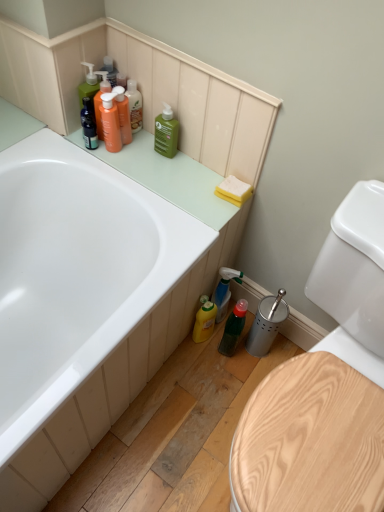
At what (x,y) coordinates should I click in order to perform the action: click on translucent green spray bottle at lower right, positioned as the fourth cleaning product in left-to-right order. Please return your answer as a coordinate pair (x, y). Image resolution: width=384 pixels, height=512 pixels. Looking at the image, I should click on (224, 290).

Describe the element at coordinates (354, 281) in the screenshot. I see `wooden toilet seat at lower right` at that location.

Based on the photo, measure the distance between point (282,436) and camera.

Point (282,436) is 93.60 centimeters away from camera.

The height and width of the screenshot is (512, 384). Identify the location of translucent orange bottles at upper left, arranged as the 1th toiletry when ordered from the bottom. pyautogui.click(x=110, y=122).

Measure the distance between translucent orange bottles at upper left, arranged as the 1th toiletry when ordered from the bottom, and camera.

A distance of 1.23 meters exists between translucent orange bottles at upper left, arranged as the 1th toiletry when ordered from the bottom, and camera.

Locate an element on the screen. yellow matte bottle at lower center, the 1th cleaning product from the bottom is located at coordinates (204, 322).

How far apart are white glossy bathtub at upper left and translucent orange bottle at upper left, the 4th cleaning product viewed from the right?

white glossy bathtub at upper left and translucent orange bottle at upper left, the 4th cleaning product viewed from the right, are 17.61 inches apart from each other.

This screenshot has height=512, width=384. In order to click on bathtub below the translucent orange bottle at upper left, acting as the 4th cleaning product starting from the bottom (from the image's perspective) in this screenshot , I will do `click(75, 272)`.

Based on the photo, is translucent orange bottle at upper left, the 1th cleaning product from the top, located within white glossy bathtub at upper left?

Definitely not — translucent orange bottle at upper left, the 1th cleaning product from the top, is not inside white glossy bathtub at upper left.

Considering the sizes of objects white glossy bathtub at upper left and translucent orange bottle at upper left, acting as the 4th cleaning product starting from the bottom, in the image provided, who is shorter, white glossy bathtub at upper left or translucent orange bottle at upper left, acting as the 4th cleaning product starting from the bottom,?

With less height is translucent orange bottle at upper left, acting as the 4th cleaning product starting from the bottom.

Between white glossy bathtub at upper left and green matte bottle at lower center, which one appears on the right side from the viewer's perspective?

green matte bottle at lower center.

In the scene shown: Considering the sizes of objects white glossy bathtub at upper left and green matte bottle at lower center in the image provided, who is taller, white glossy bathtub at upper left or green matte bottle at lower center?

→ With more height is white glossy bathtub at upper left.

Does white glossy bathtub at upper left turn towards green matte bottle at lower center?

Yes, white glossy bathtub at upper left is aimed at green matte bottle at lower center.

At what (x,y) coordinates should I click in order to perform the action: click on bathtub to the left of green matte bottle at lower center. Please return your answer as a coordinate pair (x, y). The width and height of the screenshot is (384, 512). Looking at the image, I should click on (75, 272).

Is point (102, 114) behind point (135, 94)?

That is False.

How many degrees apart are the facing directions of translucent orange bottles at upper left, arranged as the 1th toiletry when ordered from the bottom, and translucent orange bottle at upper left, the 2th toiletry ordered from the bottom?

The angular difference between translucent orange bottles at upper left, arranged as the 1th toiletry when ordered from the bottom, and translucent orange bottle at upper left, the 2th toiletry ordered from the bottom, is 0.00454 degrees.

Who is bigger, translucent orange bottles at upper left, arranged as the 1th toiletry when ordered from the bottom, or translucent orange bottle at upper left, the 1th toiletry from the top?

With larger size is translucent orange bottles at upper left, arranged as the 1th toiletry when ordered from the bottom.

Is translucent orange bottles at upper left, which ranks as the second toiletry in top-to-bottom order, not near translucent orange bottle at upper left, the 2th toiletry ordered from the bottom?

translucent orange bottles at upper left, which ranks as the second toiletry in top-to-bottom order, is actually quite close to translucent orange bottle at upper left, the 2th toiletry ordered from the bottom.

Is green matte bottle at lower center not near yellow matte bottle at lower center, the second cleaning product positioned from the right?

No, green matte bottle at lower center is not far away from yellow matte bottle at lower center, the second cleaning product positioned from the right.

Is green matte bottle at lower center surrounding yellow matte bottle at lower center, which ranks as the fourth cleaning product in top-to-bottom order?

No, yellow matte bottle at lower center, which ranks as the fourth cleaning product in top-to-bottom order, is not surrounded by green matte bottle at lower center.

Could you tell me if green matte bottle at lower center is facing yellow matte bottle at lower center, the second cleaning product positioned from the right?

No, green matte bottle at lower center is not turned towards yellow matte bottle at lower center, the second cleaning product positioned from the right.

Which of these two, green matte bottle at lower center or yellow matte bottle at lower center, the 3th cleaning product in the left-to-right sequence, is thinner?

yellow matte bottle at lower center, the 3th cleaning product in the left-to-right sequence.

In the scene shown: Is white glossy bathtub at upper left closer to camera compared to yellow matte bottle at lower center, the 1th cleaning product from the bottom?

Yes, it is.

Does white glossy bathtub at upper left have a larger size compared to yellow matte bottle at lower center, the second cleaning product positioned from the right?

Correct, white glossy bathtub at upper left is larger in size than yellow matte bottle at lower center, the second cleaning product positioned from the right.

Does white glossy bathtub at upper left contain yellow matte bottle at lower center, which ranks as the fourth cleaning product in top-to-bottom order?

No, yellow matte bottle at lower center, which ranks as the fourth cleaning product in top-to-bottom order, is not inside white glossy bathtub at upper left.

From the image's perspective, which is below, white glossy bathtub at upper left or yellow matte bottle at lower center, which ranks as the fourth cleaning product in top-to-bottom order?

yellow matte bottle at lower center, which ranks as the fourth cleaning product in top-to-bottom order, from the image's perspective.

Is translucent green spray bottle at lower right, the first cleaning product in the right-to-left sequence, positioned in front of white glossy bathtub at upper left?

No, translucent green spray bottle at lower right, the first cleaning product in the right-to-left sequence, is further to the viewer.

Could you tell me if translucent green spray bottle at lower right, positioned as the fourth cleaning product in left-to-right order, is turned towards white glossy bathtub at upper left?

No.

Is white glossy bathtub at upper left a part of translucent green spray bottle at lower right, the first cleaning product in the right-to-left sequence?

No.

Considering the relative sizes of translucent green spray bottle at lower right, positioned as the fourth cleaning product in left-to-right order, and white glossy bathtub at upper left in the image provided, is translucent green spray bottle at lower right, positioned as the fourth cleaning product in left-to-right order, wider than white glossy bathtub at upper left?

No, translucent green spray bottle at lower right, positioned as the fourth cleaning product in left-to-right order, is not wider than white glossy bathtub at upper left.

Considering the sizes of objects green matte bottle at upper center, the second cleaning product in the left-to-right sequence, and translucent green spray bottle at lower right, positioned as the fourth cleaning product in left-to-right order, in the image provided, who is smaller, green matte bottle at upper center, the second cleaning product in the left-to-right sequence, or translucent green spray bottle at lower right, positioned as the fourth cleaning product in left-to-right order,?

Smaller between the two is green matte bottle at upper center, the second cleaning product in the left-to-right sequence.

Is green matte bottle at upper center, which ranks as the third cleaning product in right-to-left order, spatially inside translucent green spray bottle at lower right, the first cleaning product in the right-to-left sequence, or outside of it?

green matte bottle at upper center, which ranks as the third cleaning product in right-to-left order, exists outside the volume of translucent green spray bottle at lower right, the first cleaning product in the right-to-left sequence.

Considering the points (163, 121) and (226, 310), which point is in front, point (163, 121) or point (226, 310)?

The point (163, 121) is closer.

Between green matte bottle at upper center, the second cleaning product in the left-to-right sequence, and translucent green spray bottle at lower right, which is the second cleaning product from bottom to top, which one has less height?

With less height is green matte bottle at upper center, the second cleaning product in the left-to-right sequence.

At what (x,y) coordinates should I click in order to perform the action: click on cleaning product that is the 2nd object above the white glossy bathtub at upper left (from a real-world perspective). Please return your answer as a coordinate pair (x, y). This screenshot has width=384, height=512. Looking at the image, I should click on (123, 114).

The width and height of the screenshot is (384, 512). In order to click on mouthwash below the white glossy bathtub at upper left (from a real-world perspective) in this screenshot , I will do [x=233, y=328].

Looking at the image, which one is located further to yellow sponge at upper right, translucent orange bottles at upper left, which ranks as the second toiletry in top-to-bottom order, or translucent orange bottle at upper left, the 1th toiletry from the top?

translucent orange bottles at upper left, which ranks as the second toiletry in top-to-bottom order, is positioned further to the anchor yellow sponge at upper right.

Considering their positions, is yellow sponge at upper right positioned closer to green matte bottle at lower center than green matte bottle at upper center, the second cleaning product in the left-to-right sequence?

yellow sponge at upper right is positioned closer to the anchor green matte bottle at lower center.

In the scene shown: Looking at the image, which one is located further to yellow sponge at upper right, wooden toilet seat at lower right or green matte bottle at upper center, the 3th cleaning product positioned from the bottom?

wooden toilet seat at lower right lies further to yellow sponge at upper right than the other object.

When comparing their distances from green matte bottle at upper center, the 3th cleaning product positioned from the bottom, does wooden toilet seat at lower right or yellow matte bottle at lower center, the second cleaning product positioned from the right, seem further?

The object further to green matte bottle at upper center, the 3th cleaning product positioned from the bottom, is wooden toilet seat at lower right.

From the image, which object appears to be farther from yellow sponge at upper right, translucent orange bottles at upper left, arranged as the 1th toiletry when ordered from the bottom, or green matte bottle at upper center, the 3th cleaning product positioned from the bottom?

Among the two, translucent orange bottles at upper left, arranged as the 1th toiletry when ordered from the bottom, is located further to yellow sponge at upper right.

From the image, which object appears to be nearer to translucent green spray bottle at lower right, arranged as the third cleaning product when viewed from the top, translucent orange bottles at upper left, which ranks as the second toiletry in top-to-bottom order, or translucent orange bottle at upper left, the 1th toiletry from the top?

The object closer to translucent green spray bottle at lower right, arranged as the third cleaning product when viewed from the top, is translucent orange bottles at upper left, which ranks as the second toiletry in top-to-bottom order.

In the scene shown: When comparing their distances from translucent orange bottles at upper left, which ranks as the second toiletry in top-to-bottom order, does green matte bottle at lower center or green matte bottle at upper center, the 3th cleaning product positioned from the bottom, seem closer?

green matte bottle at upper center, the 3th cleaning product positioned from the bottom.

From the image, which object appears to be farther from translucent orange bottle at upper left, the 1th toiletry from the top, white glossy bathtub at upper left or yellow matte bottle at lower center, the 3th cleaning product in the left-to-right sequence?

Based on the image, yellow matte bottle at lower center, the 3th cleaning product in the left-to-right sequence, appears to be further to translucent orange bottle at upper left, the 1th toiletry from the top.

The height and width of the screenshot is (512, 384). What are the coordinates of `toiletry between translucent orange bottle at upper left, which ranks as the first cleaning product in left-to-right order, and wooden toilet seat at lower right from top to bottom` in the screenshot? It's located at (110, 122).

Find the location of `mouthwash between white glossy bathtub at upper left and translucent green spray bottle at lower right, positioned as the fourth cleaning product in left-to-right order, in the front-back direction`. mouthwash between white glossy bathtub at upper left and translucent green spray bottle at lower right, positioned as the fourth cleaning product in left-to-right order, in the front-back direction is located at coordinates (233, 328).

Where is `toiletry located between white glossy bathtub at upper left and yellow sponge at upper right in the depth direction`? Image resolution: width=384 pixels, height=512 pixels. toiletry located between white glossy bathtub at upper left and yellow sponge at upper right in the depth direction is located at coordinates (110, 122).

Where is `toiletry that lies between translucent orange bottle at upper left, the 2th toiletry ordered from the bottom, and yellow matte bottle at lower center, the 3th cleaning product in the left-to-right sequence, from top to bottom`? toiletry that lies between translucent orange bottle at upper left, the 2th toiletry ordered from the bottom, and yellow matte bottle at lower center, the 3th cleaning product in the left-to-right sequence, from top to bottom is located at coordinates pos(110,122).